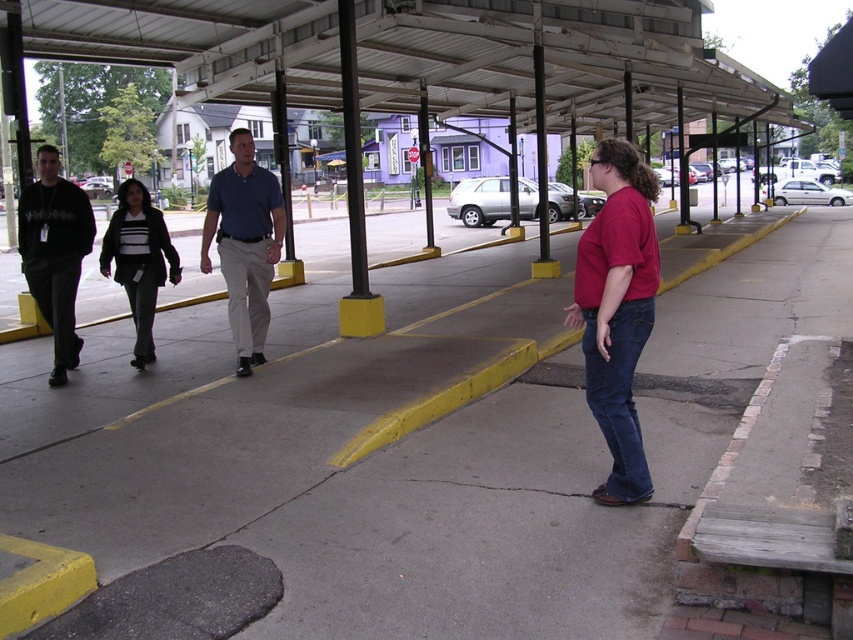
You are a photographer trying to capture a group of people walking in the parking area. You notice two individuals wearing a matte red shirt at center and a matte black sweater at center. Which one is standing to the right of the other?

The matte red shirt at center is positioned on the right side of the matte black sweater at center.

You are standing at the center of the parking area and see the matte red shirt at center. If you want to walk directly towards it, which direction should you move?

Since the matte red shirt at center is located at coordinates approximately 0.484 on the x and 0.725 on the y axis, you should move forward towards the center of the parking area to reach it.